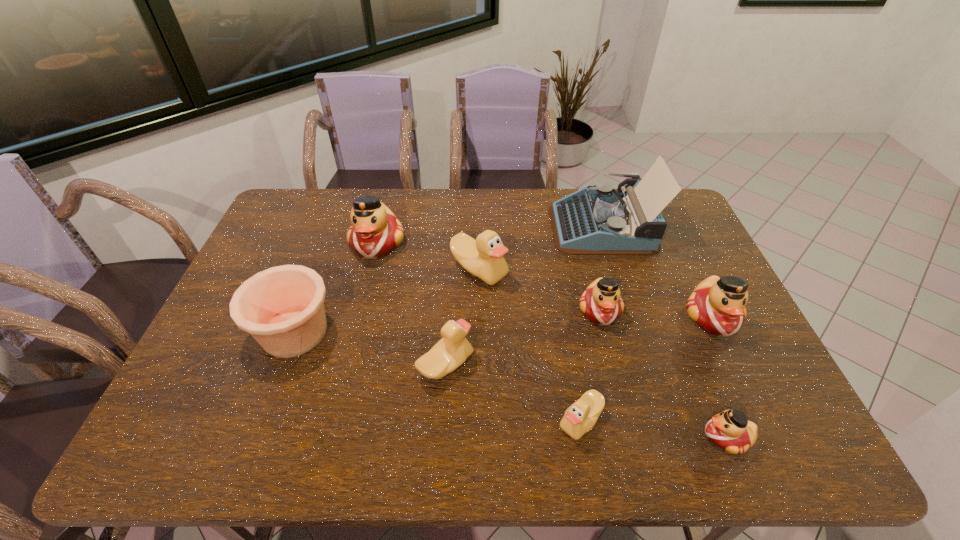
Locate an element on the screen. The image size is (960, 540). object at the far right corner is located at coordinates (591, 221).

Identify the location of object that is at the near right corner. The height and width of the screenshot is (540, 960). (x=730, y=430).

In the image, there is a desktop. Identify the location of vacant space at the near edge. (453, 451).

This screenshot has height=540, width=960. Identify the location of vacant space at the left edge of the desktop. (225, 416).

Where is `free space at the right edge of the desktop`? The image size is (960, 540). free space at the right edge of the desktop is located at coordinates (696, 286).

In the image, there is a desktop. Where is `free space at the far left corner`? free space at the far left corner is located at coordinates (297, 201).

The width and height of the screenshot is (960, 540). I want to click on blank region between the pottery and the second smallest beige duck, so click(371, 349).

The height and width of the screenshot is (540, 960). I want to click on empty space between the pottery and the blue typewriter, so click(448, 279).

Image resolution: width=960 pixels, height=540 pixels. I want to click on vacant space that's between the biggest beige duck and the blue typewriter, so click(x=540, y=248).

I want to click on empty space that is in between the third red duck from right to left and the second biggest beige duck, so click(x=523, y=338).